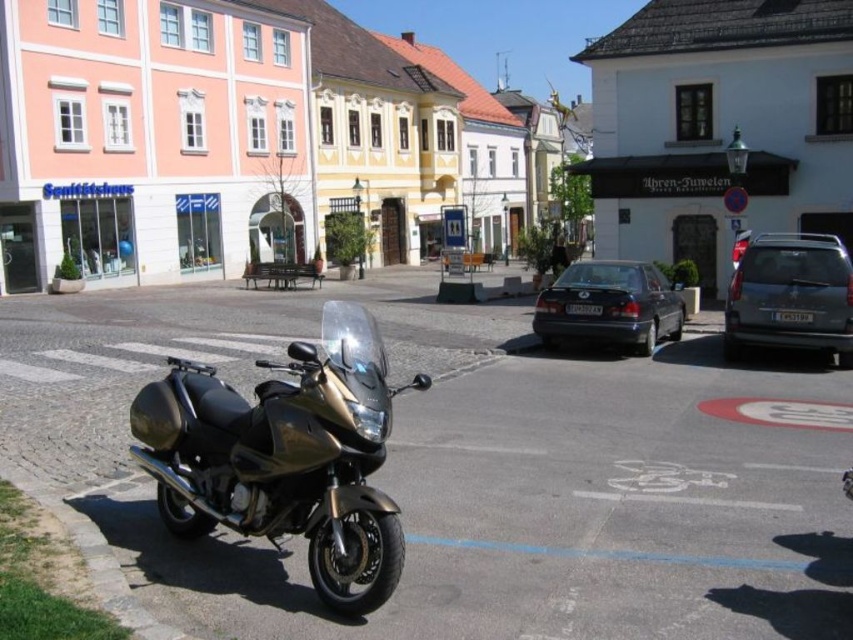
You are a delivery person needing to park your vehicle in this urban area. You have a choice between the matte gold motorcycle at lower left and the matte black sedan at center. Considering the space available, which vehicle would require more space to park?

The matte gold motorcycle at lower left has a larger size compared to the matte black sedan at center, so it would require more space to park.

You are a delivery driver navigating through the urban street scene. You need to deliver a package to a location marked by point (247, 228) and then to another location marked by point (204, 420). Which delivery point should you visit first to follow the most efficient route?

You should visit point (204, 420) first because point (247, 228) is behind it, so reaching the latter first would require backtracking to access the former.